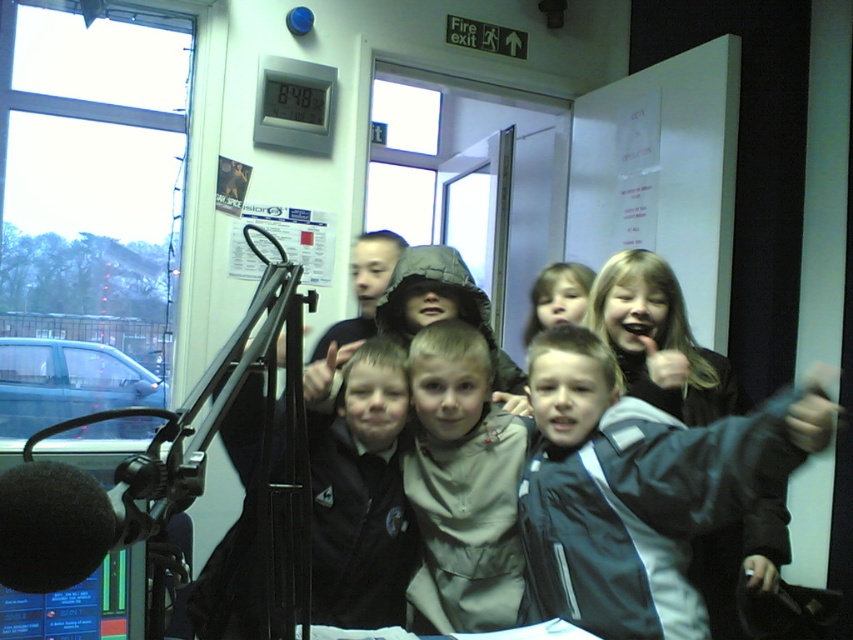
You are a photographer trying to position a light source to illuminate the dark blue jacket at center. Given the jacket is at coordinates 0.766, 0.748, where should you place the light source to ensure it faces the jacket directly?

The light source should be placed opposite the dark blue jacket at center, facing towards its coordinates to ensure direct illumination.